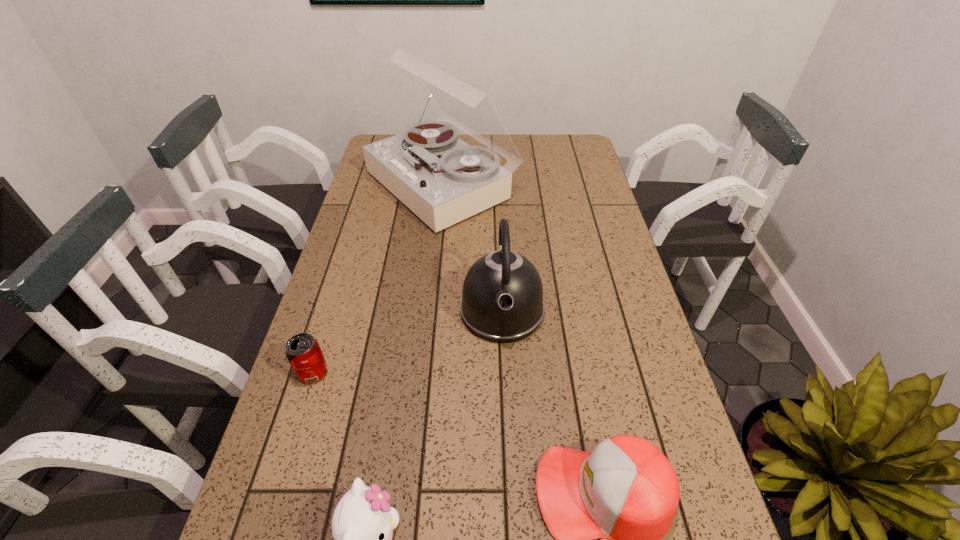
This screenshot has width=960, height=540. What are the coordinates of `record player` in the screenshot? It's located at (443, 180).

At what (x,y) coordinates should I click in order to perform the action: click on the tallest object. Please return your answer as a coordinate pair (x, y). Looking at the image, I should click on (443, 180).

Find the location of a particular element. The image size is (960, 540). the second farthest object is located at coordinates (502, 301).

I want to click on the second tallest object, so [x=502, y=301].

The image size is (960, 540). Find the location of `soda can`. soda can is located at coordinates (303, 352).

Find the location of `vacant point located 0.120m on the front of the tallest object`. vacant point located 0.120m on the front of the tallest object is located at coordinates (433, 262).

You are a GUI agent. You are given a task and a screenshot of the screen. Output one action in this format:
    pyautogui.click(x=<x>, y=<y>)
    Task: Click on the vacant region located on the spout of the kettle
    The width and height of the screenshot is (960, 540).
    Given the screenshot: What is the action you would take?
    pyautogui.click(x=512, y=521)

Locate an element on the screen. The width and height of the screenshot is (960, 540). vacant space situated on the front of the soda can is located at coordinates (272, 507).

Find the location of `object present at the far edge`. object present at the far edge is located at coordinates (443, 180).

At what (x,y) coordinates should I click in order to perform the action: click on record player that is positioned at the left edge. Please return your answer as a coordinate pair (x, y). This screenshot has width=960, height=540. Looking at the image, I should click on (443, 180).